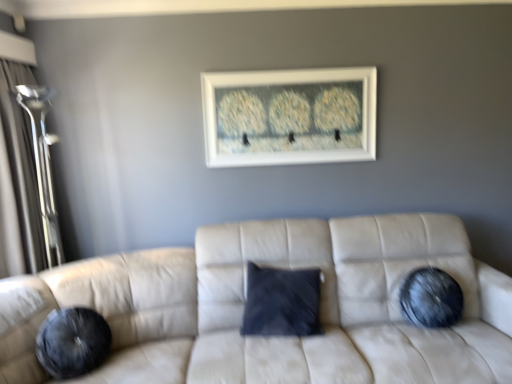
Locate an element on the screen. vacant region above white matte picture frame at upper center (from a real-world perspective) is located at coordinates click(287, 64).